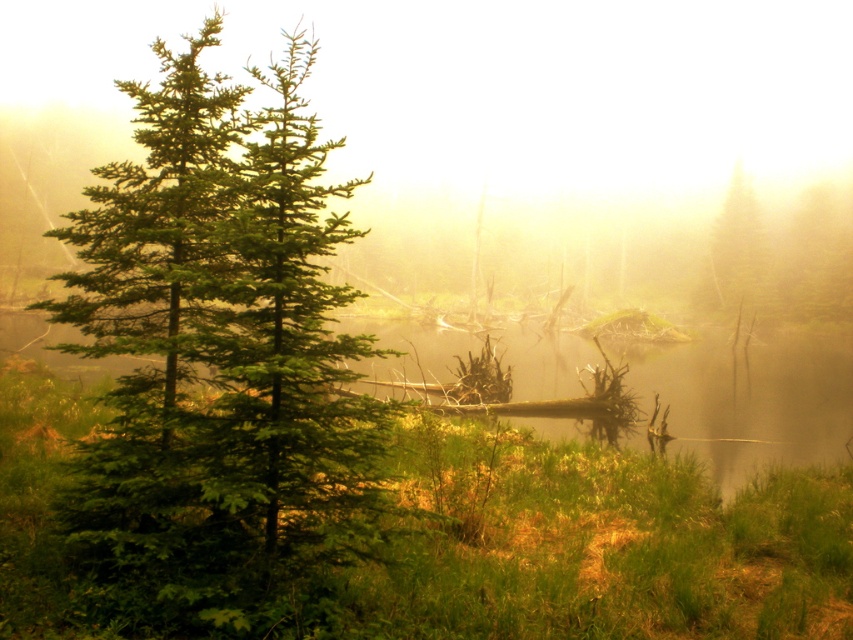
Question: Does green matte tree at left appear under green matte tree at upper right?

Choices:
 (A) no
 (B) yes

Answer: (A)

Question: Among these objects, which one is nearest to the camera?

Choices:
 (A) green matte tree at left
 (B) green matte tree at upper right

Answer: (A)

Question: Is green matte tree at left closer to camera compared to green matte tree at upper right?

Choices:
 (A) yes
 (B) no

Answer: (A)

Question: Can you confirm if green matte tree at left is wider than green matte tree at upper right?

Choices:
 (A) no
 (B) yes

Answer: (B)

Question: Which point is closer to the camera?

Choices:
 (A) (260, 244)
 (B) (752, 209)

Answer: (A)